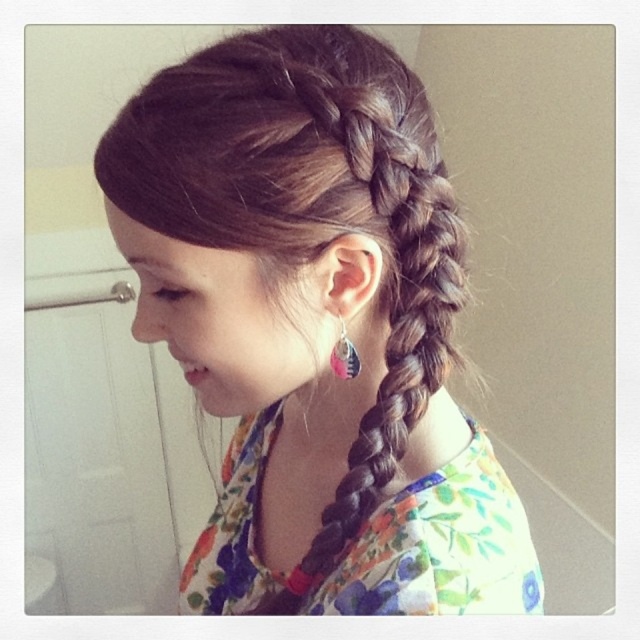
Question: Which point appears closest to the camera in this image?

Choices:
 (A) (461, 573)
 (B) (355, 352)

Answer: (A)

Question: From the image, what is the correct spatial relationship of dark brown hair at center in relation to pink fabric earring at ear?

Choices:
 (A) right
 (B) left

Answer: (B)

Question: Considering the relative positions of dark brown hair at center and pink fabric earring at ear in the image provided, where is dark brown hair at center located with respect to pink fabric earring at ear?

Choices:
 (A) right
 (B) left

Answer: (B)

Question: Observing the image, what is the correct spatial positioning of dark brown hair at center in reference to pink fabric earring at ear?

Choices:
 (A) right
 (B) left

Answer: (B)